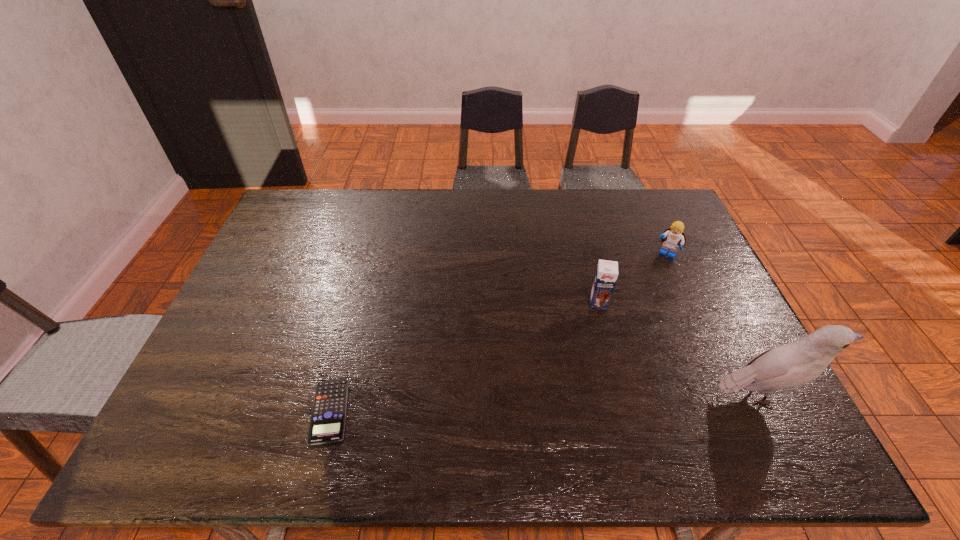
Where is `vacant space that satisfies the following two spatial constraints: 1. on the back side of the third shortest object; 2. on the left side of the calculator`? Image resolution: width=960 pixels, height=540 pixels. vacant space that satisfies the following two spatial constraints: 1. on the back side of the third shortest object; 2. on the left side of the calculator is located at coordinates (358, 302).

The image size is (960, 540). I want to click on vacant region that satisfies the following two spatial constraints: 1. on the front side of the bird; 2. at the beak of the third nearest object, so click(x=622, y=395).

You are a GUI agent. You are given a task and a screenshot of the screen. Output one action in this format:
    pyautogui.click(x=<x>, y=<y>)
    Task: Click on the vacant region that satisfies the following two spatial constraints: 1. on the back side of the leftmost object; 2. on the left side of the second tallest object
    
    Given the screenshot: What is the action you would take?
    pyautogui.click(x=358, y=302)